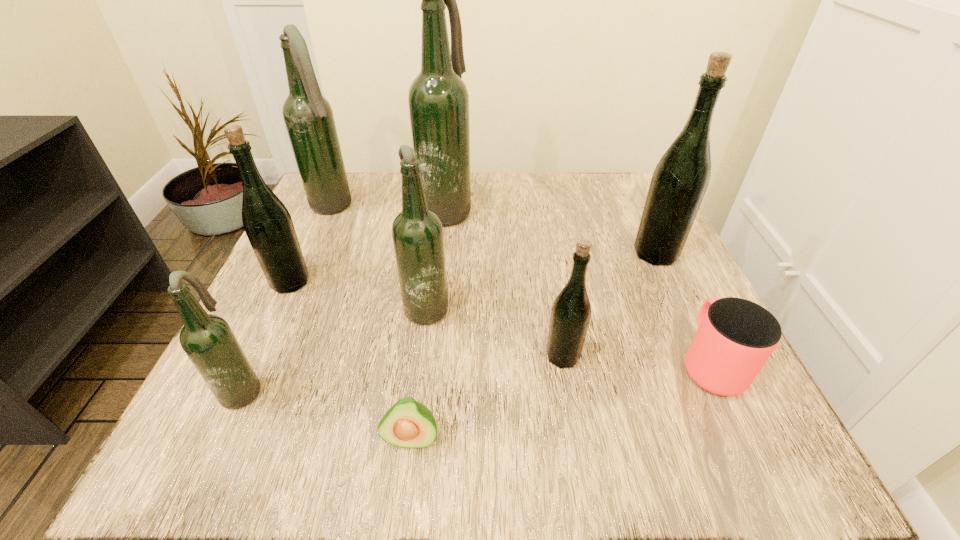
Locate an element on the screen. The image size is (960, 540). free space at the far edge is located at coordinates (570, 218).

Where is `vacant space at the left edge of the desktop`? This screenshot has height=540, width=960. vacant space at the left edge of the desktop is located at coordinates 288,400.

You are a GUI agent. You are given a task and a screenshot of the screen. Output one action in this format:
    pyautogui.click(x=<x>, y=<y>)
    Task: Click on the free space at the right edge of the desktop
    The height and width of the screenshot is (540, 960).
    Given the screenshot: What is the action you would take?
    pyautogui.click(x=639, y=284)

Locate an element on the screen. Image resolution: width=960 pixels, height=540 pixels. free space at the far left corner of the desktop is located at coordinates (387, 177).

At what (x,y) coordinates should I click in order to perform the action: click on vacant space at the far right corner of the desktop. Please return your answer as a coordinate pair (x, y). Looking at the image, I should click on (585, 191).

Where is `vacant space at the near right corner of the desktop`? The image size is (960, 540). vacant space at the near right corner of the desktop is located at coordinates (748, 454).

I want to click on vacant space that is in between the cup and the third smallest dark beer bottle, so click(521, 285).

The image size is (960, 540). What are the coordinates of `free space between the third farthest dark beer bottle and the second biggest dark beer bottle` in the screenshot? It's located at (380, 256).

At what (x,y) coordinates should I click in order to perform the action: click on free area in between the nearest dark beer bottle and the second farthest green beer bottle. Please return your answer as a coordinate pair (x, y). This screenshot has width=960, height=540. Looking at the image, I should click on click(267, 335).

The width and height of the screenshot is (960, 540). I want to click on free space between the green avocado and the cup, so click(561, 401).